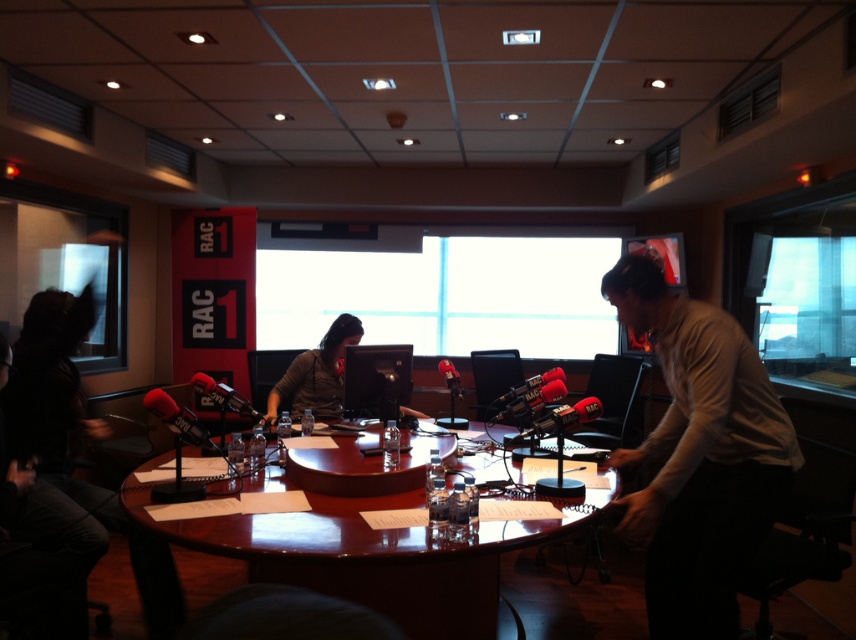
Question: Does white shirt at center appear under shiny wooden table at center?

Choices:
 (A) no
 (B) yes

Answer: (A)

Question: Can you confirm if shiny wooden table at center is bigger than matte black monitor at center?

Choices:
 (A) yes
 (B) no

Answer: (A)

Question: Can you confirm if white shirt at center is positioned to the left of matte black monitor at center?

Choices:
 (A) yes
 (B) no

Answer: (B)

Question: Which of the following is the farthest from the observer?

Choices:
 (A) (321, 408)
 (B) (706, 525)

Answer: (A)

Question: Which point appears farthest from the camera in this image?

Choices:
 (A) (336, 372)
 (B) (724, 417)

Answer: (A)

Question: Considering the real-world distances, which object is farthest from the white shirt at center?

Choices:
 (A) matte black monitor at center
 (B) shiny wooden table at center

Answer: (A)